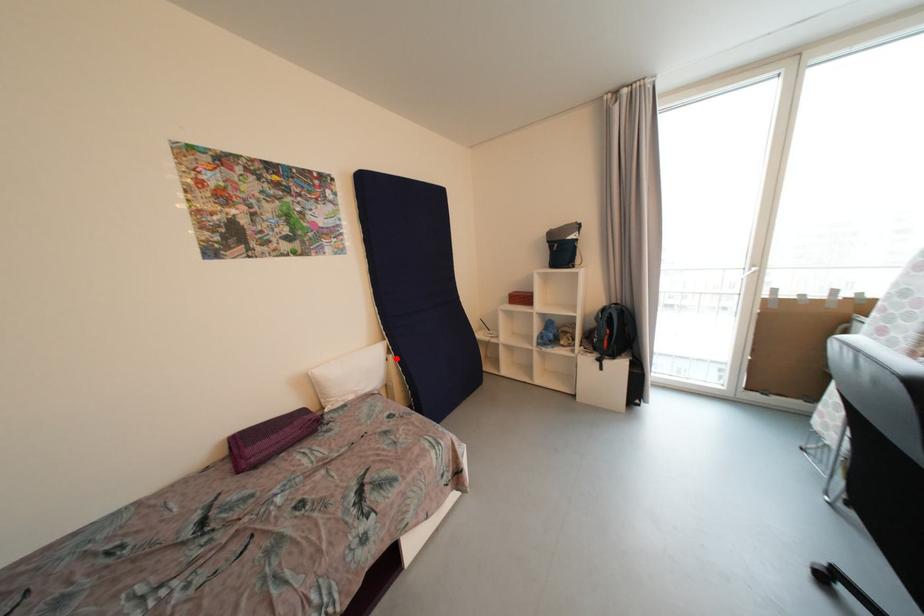
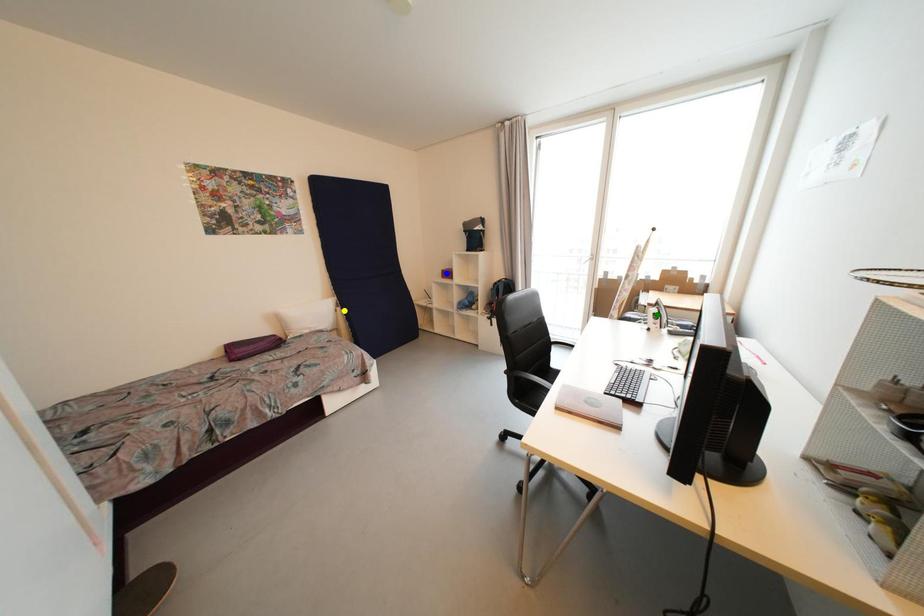
Question: I am providing you with two images of the same scene from different viewpoints. A red point is marked on the first image. You are given multiple points on the second image. Which spot in image 2 lines up with the point in image 1?

Choices:
 (A) blue point
 (B) yellow point
 (C) green point

Answer: (B)